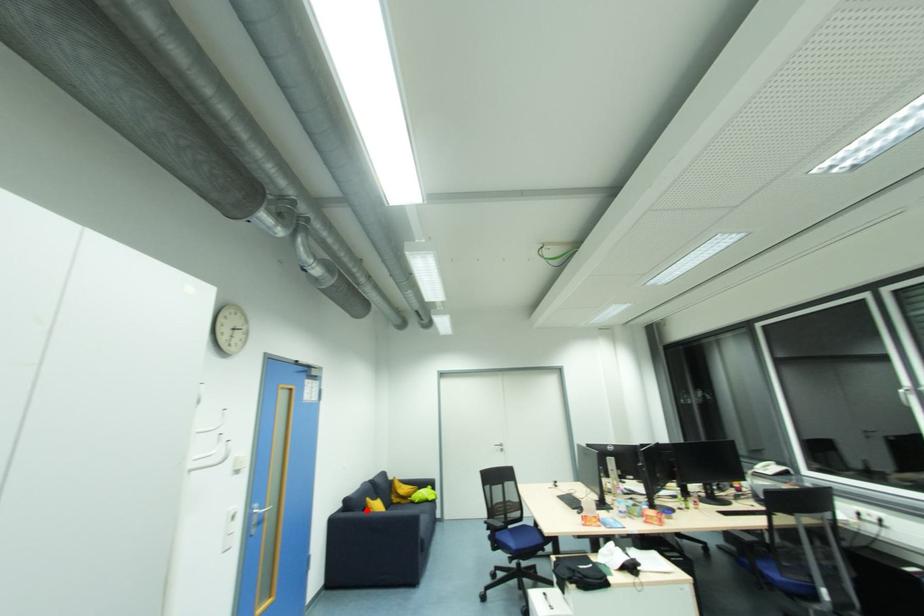
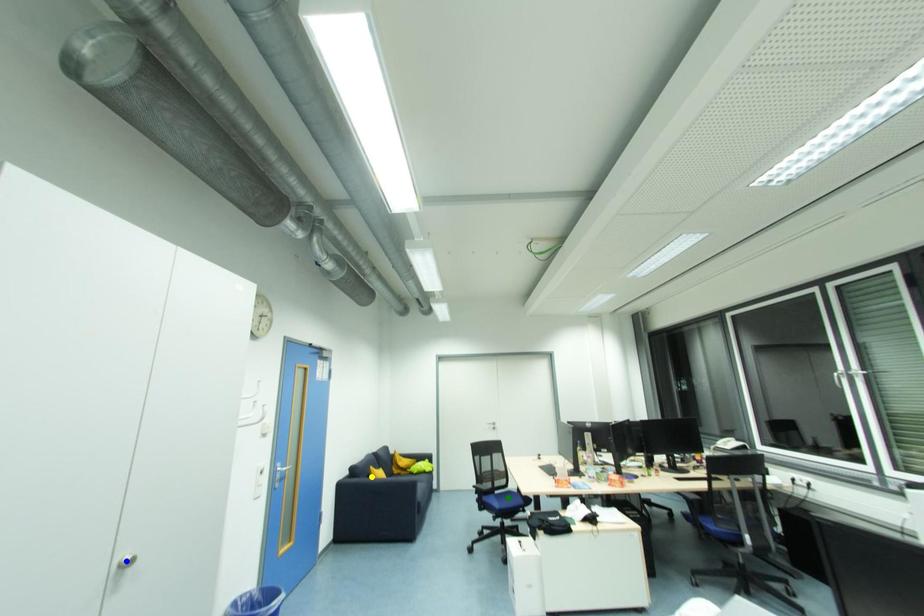
Question: I am providing you with two images of the same scene from different viewpoints. A red point is marked on the first image. You are given multiple points on the second image. Which point in image 2 represents the same 3d spot as the red point in image 1?

Choices:
 (A) green point
 (B) yellow point
 (C) blue point

Answer: (B)